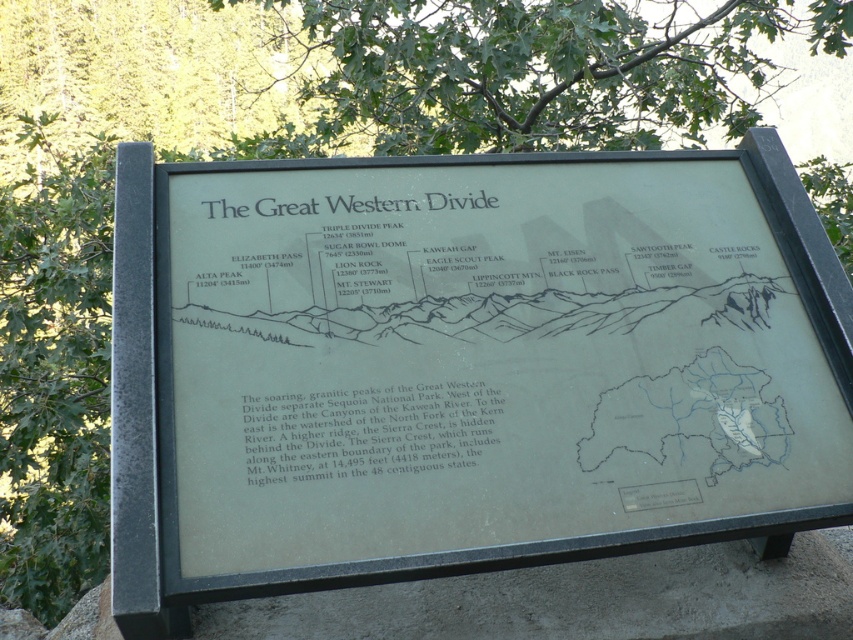
Identify the location of black paper text at center. This screenshot has height=640, width=853. (367, 429).

Which is more to the left, black paper text at center or transparent paper map at center?

black paper text at center is more to the left.

Which is behind, point (396, 438) or point (693, 435)?

Point (693, 435)

I want to click on black paper text at center, so click(x=367, y=429).

This screenshot has width=853, height=640. Find the location of `transparent paper map at center`. transparent paper map at center is located at coordinates (691, 417).

Who is positioned more to the left, transparent paper map at center or white plastic sign at lower right?

From the viewer's perspective, white plastic sign at lower right appears more on the left side.

Who is more distant from viewer, (641, 401) or (672, 504)?

Point (641, 401)

Find the location of a particular element. This screenshot has height=640, width=853. transparent paper map at center is located at coordinates (691, 417).

Who is lower down, metallic plaque at center or black paper text at center?

black paper text at center

Between point (755, 224) and point (426, 422), which one is positioned behind?

Point (755, 224)

Describe the element at coordinates (463, 365) in the screenshot. The image size is (853, 640). I see `metallic plaque at center` at that location.

At what (x,y) coordinates should I click in order to perform the action: click on metallic plaque at center. Please return your answer as a coordinate pair (x, y). The height and width of the screenshot is (640, 853). Looking at the image, I should click on (463, 365).